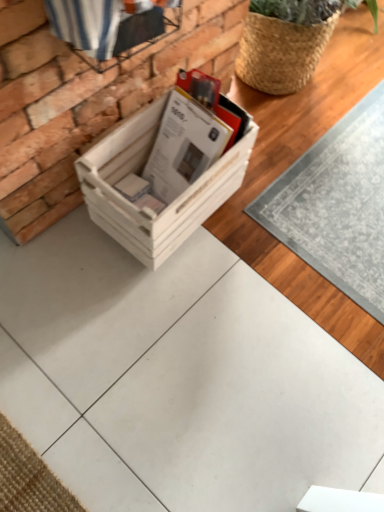
At what (x,y) coordinates should I click in order to perform the action: click on space that is in front of white wood crate at center. Please return your answer as a coordinate pair (x, y). This screenshot has width=384, height=512. Looking at the image, I should click on (160, 276).